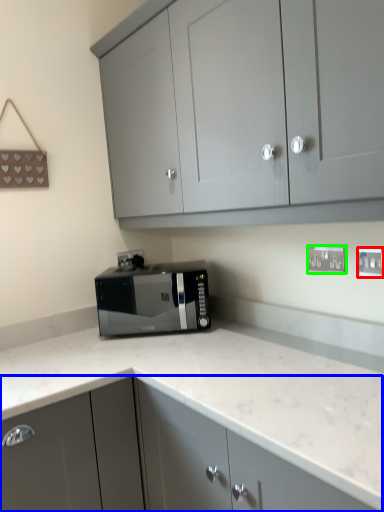
Question: Estimate the real-world distances between objects in this image. Which object is closer to electric outlet (highlighted by a red box), cabinetry (highlighted by a blue box) or electric outlet (highlighted by a green box)?

Choices:
 (A) cabinetry
 (B) electric outlet

Answer: (B)